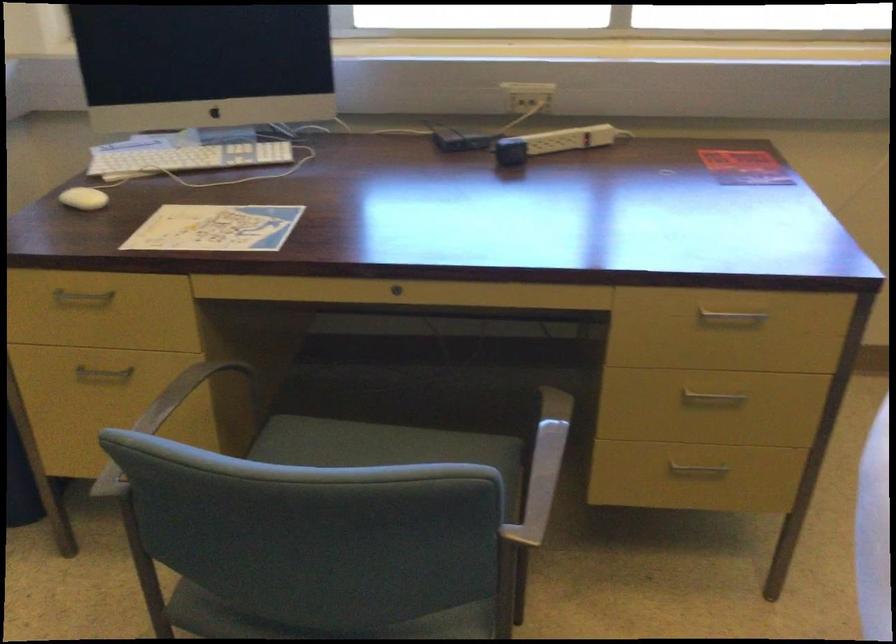
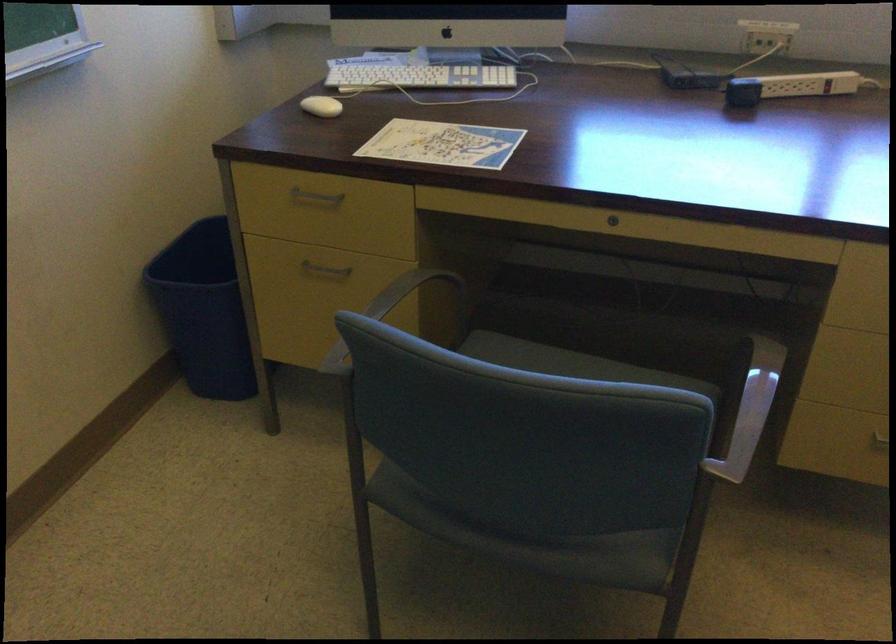
Where in the second image is the point corresponding to (x=398, y=290) from the first image?

(613, 220)